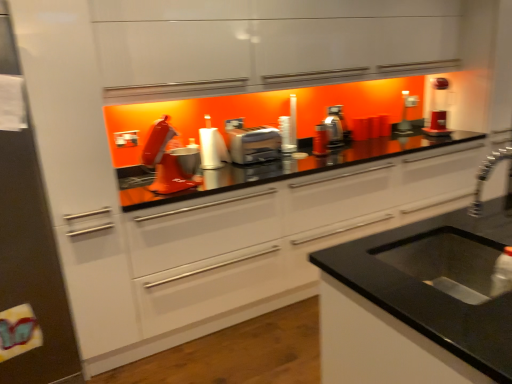
Question: From the image's perspective, is black granite sink at lower right under metallic silver toaster at center, the 1th appliance in the back-to-front sequence?

Choices:
 (A) yes
 (B) no

Answer: (A)

Question: Can you confirm if black granite sink at lower right is bigger than metallic silver toaster at center, which is the 2th appliance from front to back?

Choices:
 (A) yes
 (B) no

Answer: (A)

Question: Does black granite sink at lower right have a smaller size compared to metallic silver toaster at center, arranged as the 1th appliance when viewed from the right?

Choices:
 (A) no
 (B) yes

Answer: (A)

Question: From a real-world perspective, is black granite sink at lower right located higher than metallic silver toaster at center, arranged as the 2th appliance when viewed from the left?

Choices:
 (A) yes
 (B) no

Answer: (B)

Question: From the image's perspective, would you say black granite sink at lower right is positioned over metallic silver toaster at center, which is the 2th appliance from front to back?

Choices:
 (A) yes
 (B) no

Answer: (B)

Question: Considering the positions of matte red mixer at center, which is counted as the first appliance, starting from the front, and metallic silver toaster at center, which is the 2th appliance from front to back, in the image, is matte red mixer at center, which is counted as the first appliance, starting from the front, wider or thinner than metallic silver toaster at center, which is the 2th appliance from front to back,?

Choices:
 (A) wide
 (B) thin

Answer: (A)

Question: Is matte red mixer at center, the second appliance viewed from the top, in front of or behind metallic silver toaster at center, the 1th appliance in the back-to-front sequence, in the image?

Choices:
 (A) front
 (B) behind

Answer: (A)

Question: Is matte red mixer at center, placed as the second appliance when sorted from right to left, to the left or to the right of metallic silver toaster at center, arranged as the 1th appliance when viewed from the right, in the image?

Choices:
 (A) right
 (B) left

Answer: (B)

Question: Is matte red mixer at center, which is counted as the first appliance, starting from the front, bigger or smaller than metallic silver toaster at center, arranged as the 2th appliance when viewed from the left?

Choices:
 (A) big
 (B) small

Answer: (A)

Question: Is matte red coffee maker at upper right to the left or to the right of metallic silver toaster at center, arranged as the 2th appliance when viewed from the left, in the image?

Choices:
 (A) right
 (B) left

Answer: (A)

Question: Looking at the image, does matte red coffee maker at upper right seem bigger or smaller compared to metallic silver toaster at center, arranged as the 1th appliance when viewed from the right?

Choices:
 (A) big
 (B) small

Answer: (A)

Question: In terms of width, does matte red coffee maker at upper right look wider or thinner when compared to metallic silver toaster at center, arranged as the 2th appliance when viewed from the left?

Choices:
 (A) wide
 (B) thin

Answer: (A)

Question: Is point (442, 105) positioned closer to the camera than point (398, 122)?

Choices:
 (A) closer
 (B) farther

Answer: (A)

Question: Is matte white toaster at center wider or thinner than black granite sink at lower right?

Choices:
 (A) wide
 (B) thin

Answer: (B)

Question: Relative to black granite sink at lower right, is matte white toaster at center in front or behind?

Choices:
 (A) behind
 (B) front

Answer: (A)